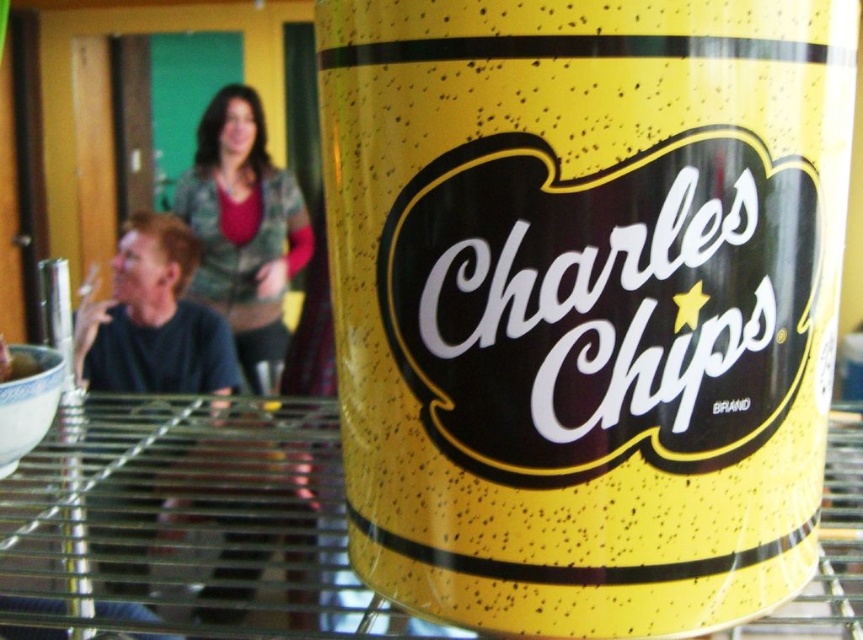
Question: Which object is positioned closest to the green textured sweater at upper center?

Choices:
 (A) transparent glass table at center
 (B) yellow speckled can at center

Answer: (A)

Question: Can you confirm if yellow speckled can at center is positioned to the right of green textured sweater at upper center?

Choices:
 (A) yes
 (B) no

Answer: (A)

Question: Estimate the real-world distances between objects in this image. Which object is closer to the yellow speckled can at center?

Choices:
 (A) transparent glass table at center
 (B) green textured sweater at upper center

Answer: (A)

Question: Considering the real-world distances, which object is closest to the transparent glass table at center?

Choices:
 (A) green textured sweater at upper center
 (B) yellow speckled can at center

Answer: (B)

Question: Considering the relative positions of yellow speckled can at center and transparent glass table at center in the image provided, where is yellow speckled can at center located with respect to transparent glass table at center?

Choices:
 (A) below
 (B) above

Answer: (B)

Question: Does yellow speckled can at center appear on the right side of transparent glass table at center?

Choices:
 (A) no
 (B) yes

Answer: (B)